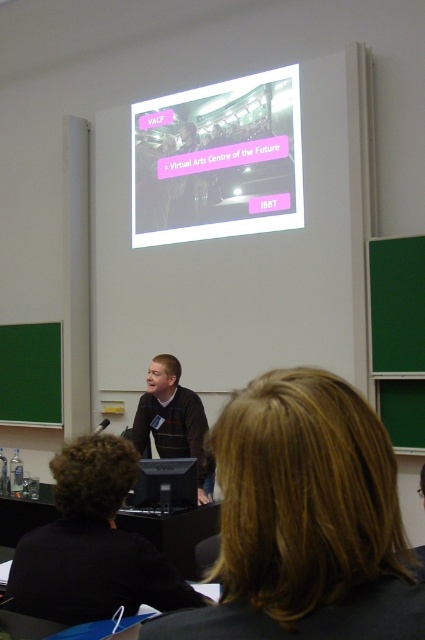
Is matte plastic projector screen at upper center behind striped sweater at center?

Yes, it is.

Is matte plastic projector screen at upper center to the right of striped sweater at center from the viewer's perspective?

Correct, you'll find matte plastic projector screen at upper center to the right of striped sweater at center.

Which is in front, point (187, 241) or point (209, 467)?

Point (209, 467) is in front.

Where is `matte plastic projector screen at upper center`? matte plastic projector screen at upper center is located at coordinates (218, 161).

Can you confirm if dark brown sweater at center is positioned to the left of matte plastic projector screen at upper center?

In fact, dark brown sweater at center is to the right of matte plastic projector screen at upper center.

Identify the location of dark brown sweater at center. [x=305, y=520].

The image size is (425, 640). Describe the element at coordinates (305, 520) in the screenshot. I see `dark brown sweater at center` at that location.

Does dark brown sweater at center have a smaller size compared to striped sweater at center?

Yes.

Identify the location of dark brown sweater at center. The image size is (425, 640). (305, 520).

This screenshot has width=425, height=640. In order to click on dark brown sweater at center in this screenshot , I will do `click(305, 520)`.